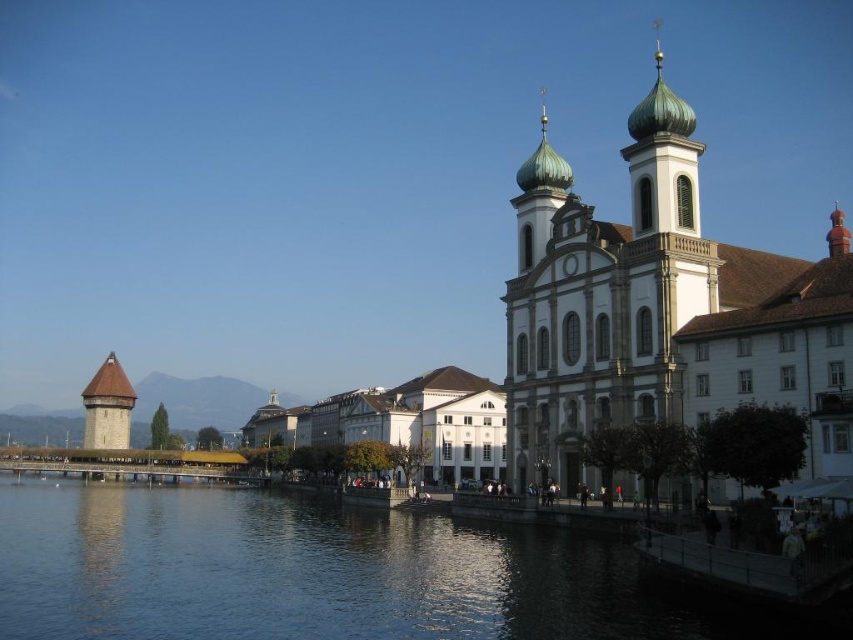
Between blue water at lower center and green copper dome church at right, which one appears on the right side from the viewer's perspective?

green copper dome church at right is more to the right.

Can you confirm if blue water at lower center is positioned to the left of green copper dome church at right?

Correct, you'll find blue water at lower center to the left of green copper dome church at right.

Between point (70, 522) and point (573, 212), which one is positioned behind?

The point (573, 212) is more distant.

Image resolution: width=853 pixels, height=640 pixels. In order to click on blue water at lower center in this screenshot , I will do `click(318, 573)`.

Consider the image. Is green copper dome church at right taller than brown wood tower at left?

Yes, green copper dome church at right is taller than brown wood tower at left.

Is green copper dome church at right above brown wood tower at left?

Correct, green copper dome church at right is located above brown wood tower at left.

Between point (654, 209) and point (97, 442), which one is positioned in front?

Point (654, 209) is in front.

Identify the location of green copper dome church at right. (648, 304).

Which of these two, blue water at lower center or brown wood tower at left, stands shorter?

blue water at lower center is shorter.

Is blue water at lower center below brown wood tower at left?

Actually, blue water at lower center is above brown wood tower at left.

At what (x,y) coordinates should I click in order to perform the action: click on blue water at lower center. Please return your answer as a coordinate pair (x, y). This screenshot has height=640, width=853. Looking at the image, I should click on (318, 573).